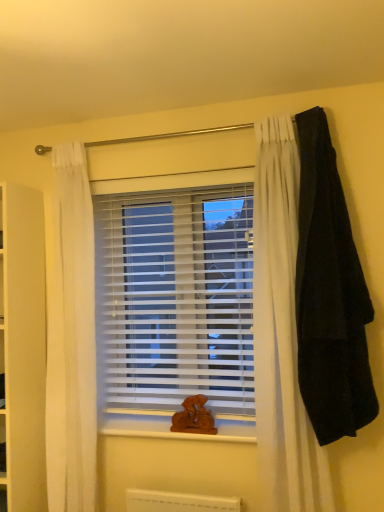
Question: In terms of height, does black woolen blanket at right look taller or shorter compared to wooden at center?

Choices:
 (A) tall
 (B) short

Answer: (A)

Question: Is point (329, 368) closer or farther from the camera than point (221, 423)?

Choices:
 (A) farther
 (B) closer

Answer: (B)

Question: Which is nearer to the white plastic blinds at center?

Choices:
 (A) black woolen blanket at right
 (B) wooden at center

Answer: (B)

Question: Estimate the real-world distances between objects in this image. Which object is farther from the white plastic blinds at center?

Choices:
 (A) wooden at center
 (B) black woolen blanket at right

Answer: (B)